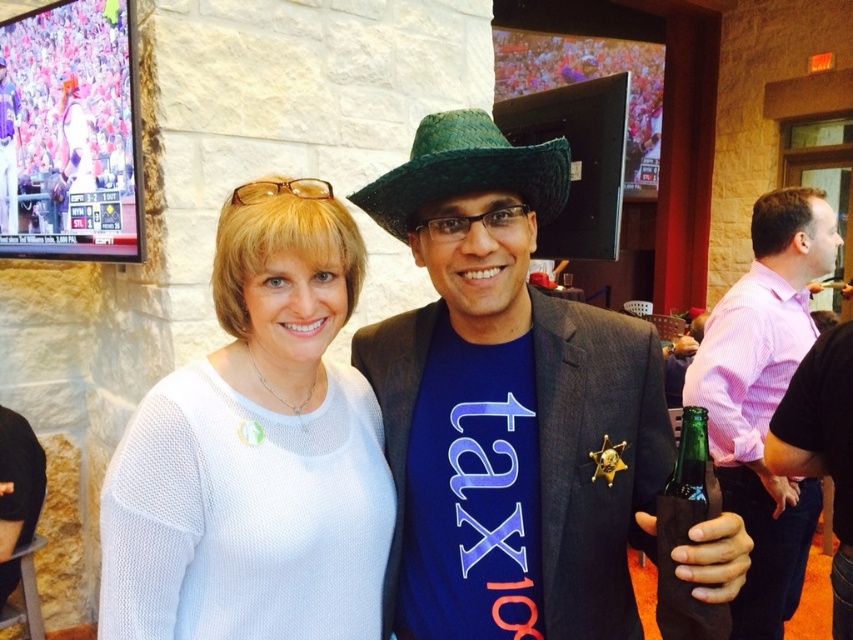
You are a bartender preparing to serve a customer. You notice the pink striped shirt at right and the green glass bottle at lower right. Which item has a greater width?

The pink striped shirt at right has a greater width than the green glass bottle at lower right.

You are a photographer who wants to ensure that both the white knitted sweater at center and the green straw cowboy hat at center are clearly visible in the photo. Based on their positions, which object is closer to the camera?

The green straw cowboy hat at center is closer to the camera because the white knitted sweater at center is positioned under it.